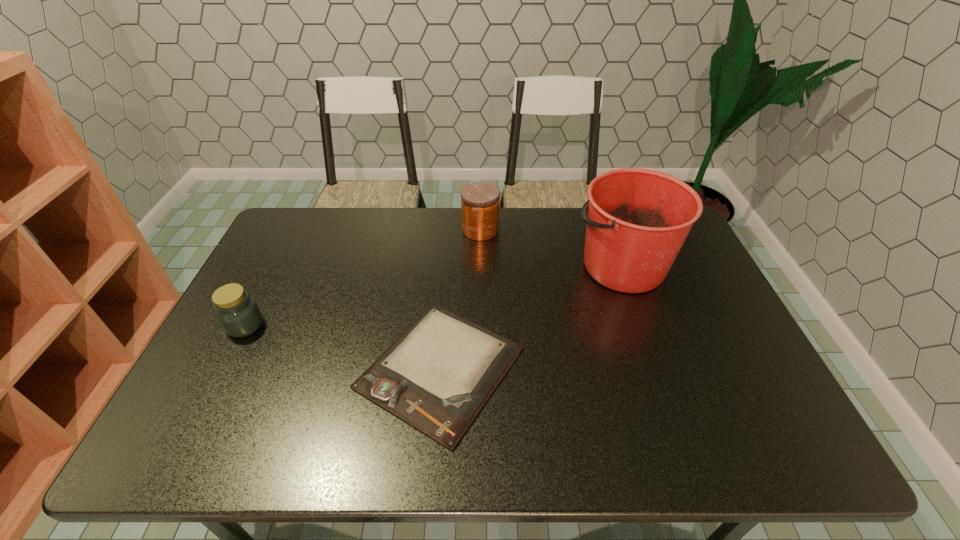
The width and height of the screenshot is (960, 540). I want to click on vacant area between the right jar and the shortest object, so click(461, 299).

This screenshot has width=960, height=540. I want to click on free space between the farther jar and the clipboard, so click(x=461, y=299).

This screenshot has height=540, width=960. Find the location of `free space between the rightmost object and the clipboard`. free space between the rightmost object and the clipboard is located at coordinates (531, 316).

Find the location of a particular element. Image resolution: width=960 pixels, height=540 pixels. object that stands as the closest to the shorter jar is located at coordinates (437, 375).

This screenshot has width=960, height=540. Identify the location of object that is the nearest to the leftmost object. (437, 375).